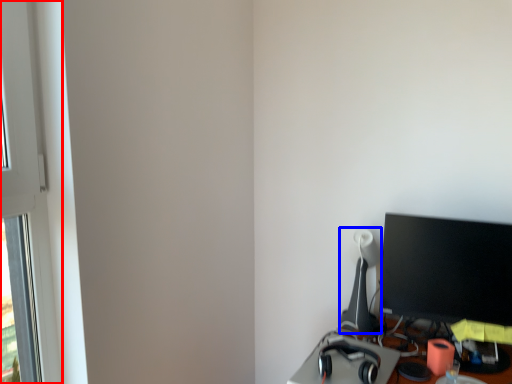
Question: Which object is further to the camera taking this photo, window frame (highlighted by a red box) or table lamp (highlighted by a blue box)?

Choices:
 (A) window frame
 (B) table lamp

Answer: (B)